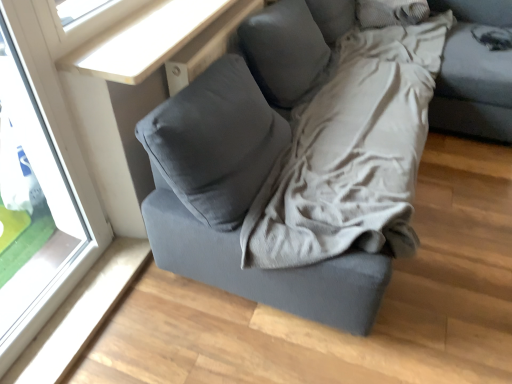
This screenshot has height=384, width=512. What do you see at coordinates (391, 12) in the screenshot?
I see `gray fabric pillow at upper right` at bounding box center [391, 12].

I want to click on gray fabric pillow at upper right, so click(391, 12).

At what (x,y) coordinates should I click in order to perform the action: click on transparent glass window at upper left. Please return your answer as a coordinate pair (x, y). This screenshot has height=384, width=512. Looking at the image, I should click on (45, 184).

Measure the distance between transparent glass window at upper left and camera.

The depth of transparent glass window at upper left is 3.83 feet.

Describe the element at coordinates (45, 184) in the screenshot. I see `transparent glass window at upper left` at that location.

Measure the distance between point [74,145] and camera.

The distance of point [74,145] from camera is 1.58 meters.

Identify the location of gray fabric pillow at upper right. (391, 12).

Considering the relative positions of transparent glass window at upper left and gray fabric pillow at upper right in the image provided, is transparent glass window at upper left to the left or to the right of gray fabric pillow at upper right?

From the image, it's evident that transparent glass window at upper left is to the left of gray fabric pillow at upper right.

In the image, is transparent glass window at upper left positioned in front of or behind gray fabric pillow at upper right?

transparent glass window at upper left is in front of gray fabric pillow at upper right.

Which point is more distant from viewer, (x=72, y=264) or (x=382, y=25)?

The point (x=382, y=25) is farther.

From the image's perspective, which object appears higher, transparent glass window at upper left or gray fabric pillow at upper right?

gray fabric pillow at upper right.

From a real-world perspective, which is physically above, transparent glass window at upper left or gray fabric pillow at upper right?

In real-world perspective, gray fabric pillow at upper right is above.

Can you confirm if transparent glass window at upper left is wider than gray fabric pillow at upper right?

No.

From their relative heights in the image, would you say transparent glass window at upper left is taller or shorter than gray fabric pillow at upper right?

In the image, transparent glass window at upper left appears to be taller than gray fabric pillow at upper right.

Does transparent glass window at upper left have a smaller size compared to gray fabric pillow at upper right?

Incorrect, transparent glass window at upper left is not smaller in size than gray fabric pillow at upper right.

Is gray fabric pillow at upper right inside transparent glass window at upper left?

No, gray fabric pillow at upper right is not surrounded by transparent glass window at upper left.

Are transparent glass window at upper left and gray fabric pillow at upper right beside each other?

transparent glass window at upper left and gray fabric pillow at upper right are not in contact.

Is transparent glass window at upper left oriented away from gray fabric pillow at upper right?

That's not correct — transparent glass window at upper left is not looking away from gray fabric pillow at upper right.

Based on the photo, can you tell me how much transparent glass window at upper left and gray fabric pillow at upper right differ in facing direction?

89.4 degrees.

How distant is transparent glass window at upper left from gray fabric pillow at upper right?

1.99 meters.

Identify the location of window that appears below the gray fabric pillow at upper right (from the image's perspective). This screenshot has width=512, height=384. (45, 184).

Can you confirm if gray fabric pillow at upper right is positioned to the right of transparent glass window at upper left?

Yes, gray fabric pillow at upper right is to the right of transparent glass window at upper left.

Which is in front, gray fabric pillow at upper right or transparent glass window at upper left?

Positioned in front is transparent glass window at upper left.

Which is farther from the camera, (392, 5) or (17, 107)?

The point (392, 5) is farther.

From the image's perspective, does gray fabric pillow at upper right appear higher than transparent glass window at upper left?

Yes.

From a real-world perspective, is gray fabric pillow at upper right above or below transparent glass window at upper left?

In terms of real-world spatial position, gray fabric pillow at upper right is above transparent glass window at upper left.

Between gray fabric pillow at upper right and transparent glass window at upper left, which one has larger width?

gray fabric pillow at upper right is wider.

Considering the relative sizes of gray fabric pillow at upper right and transparent glass window at upper left in the image provided, is gray fabric pillow at upper right shorter than transparent glass window at upper left?

Yes, gray fabric pillow at upper right is shorter than transparent glass window at upper left.

Looking at the image, does gray fabric pillow at upper right seem bigger or smaller compared to transparent glass window at upper left?

Considering their sizes, gray fabric pillow at upper right takes up less space than transparent glass window at upper left.

Would you say gray fabric pillow at upper right is inside or outside transparent glass window at upper left?

gray fabric pillow at upper right cannot be found inside transparent glass window at upper left.

Is gray fabric pillow at upper right directly adjacent to transparent glass window at upper left?

No, gray fabric pillow at upper right is not with transparent glass window at upper left.

Is gray fabric pillow at upper right oriented away from transparent glass window at upper left?

No, gray fabric pillow at upper right is not facing away from transparent glass window at upper left.

How different are the orientations of gray fabric pillow at upper right and transparent glass window at upper left in degrees?

89.4 degrees.

Where is `pillow above the transparent glass window at upper left (from a real-world perspective)`? pillow above the transparent glass window at upper left (from a real-world perspective) is located at coordinates (391, 12).

This screenshot has height=384, width=512. I want to click on window in front of the gray fabric pillow at upper right, so click(x=45, y=184).

You are a GUI agent. You are given a task and a screenshot of the screen. Output one action in this format:
    pyautogui.click(x=<x>, y=<y>)
    Task: Click on the pillow that is above the transparent glass window at upper left (from the image's perspective)
    
    Given the screenshot: What is the action you would take?
    pyautogui.click(x=391, y=12)